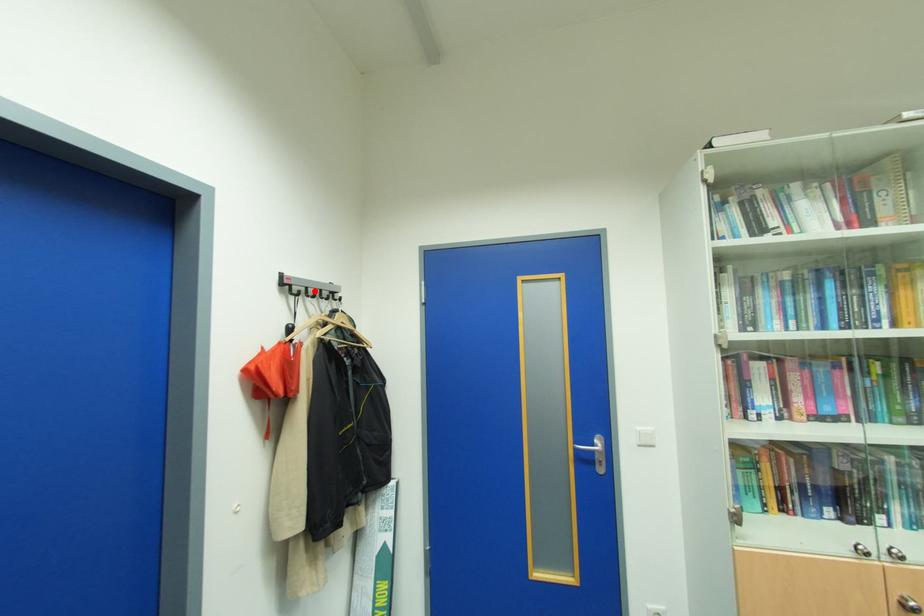
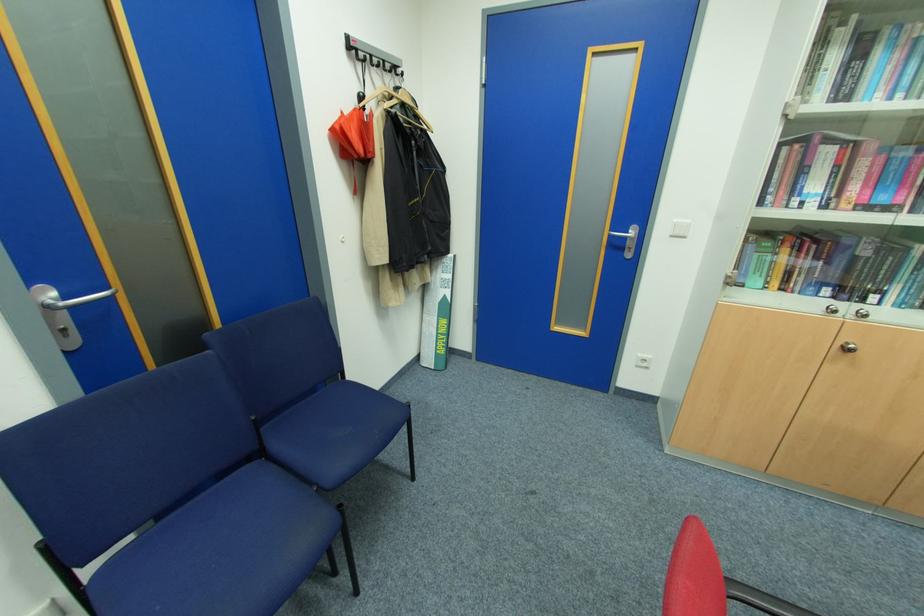
In the second image, find the point that corresponds to the highlighted location in the first image.

(380, 60)